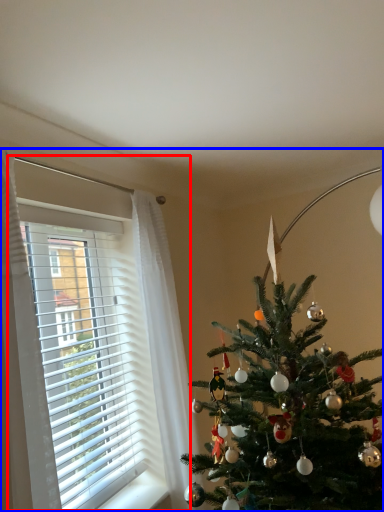
Question: Which of the following is the closest to the observer, window (highlighted by a red box) or christmas eve (highlighted by a blue box)?

Choices:
 (A) window
 (B) christmas eve

Answer: (B)